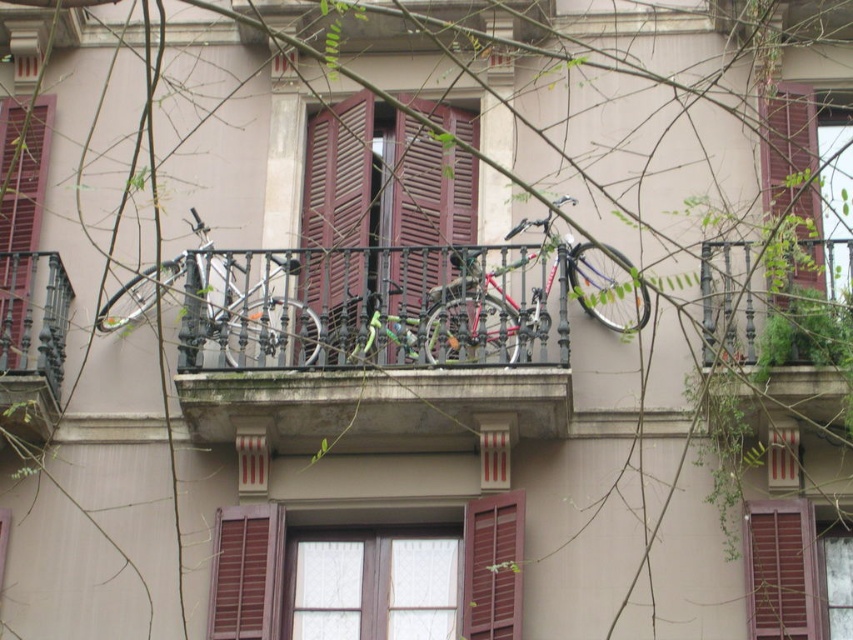
Is metallic bicycle at center below brown wooden shutter at lower center?

No, metallic bicycle at center is not below brown wooden shutter at lower center.

Is the position of metallic bicycle at center less distant than that of brown wooden shutter at lower center?

No, it is not.

Is point (422, 276) positioned after point (463, 609)?

Yes.

The image size is (853, 640). Find the location of `metallic bicycle at center`. metallic bicycle at center is located at coordinates (376, 349).

This screenshot has height=640, width=853. Describe the element at coordinates (374, 588) in the screenshot. I see `white frosted glass window at center` at that location.

Is point (440, 561) closer to camera compared to point (16, 129)?

That is True.

The height and width of the screenshot is (640, 853). Identify the location of white frosted glass window at center. (374, 588).

Locate an element on the screen. This screenshot has width=853, height=640. white frosted glass window at center is located at coordinates (374, 588).

Is brown wooden shutters at center taller than shiny metallic bicycle at center?

Indeed, brown wooden shutters at center has a greater height compared to shiny metallic bicycle at center.

At what (x,y) coordinates should I click in order to perform the action: click on brown wooden shutters at center. Please return your answer as a coordinate pair (x, y). Looking at the image, I should click on (383, 182).

Does point (405, 232) come in front of point (619, 289)?

No, it is behind (619, 289).

Where is `brown wooden shutters at center`? The image size is (853, 640). brown wooden shutters at center is located at coordinates (383, 182).